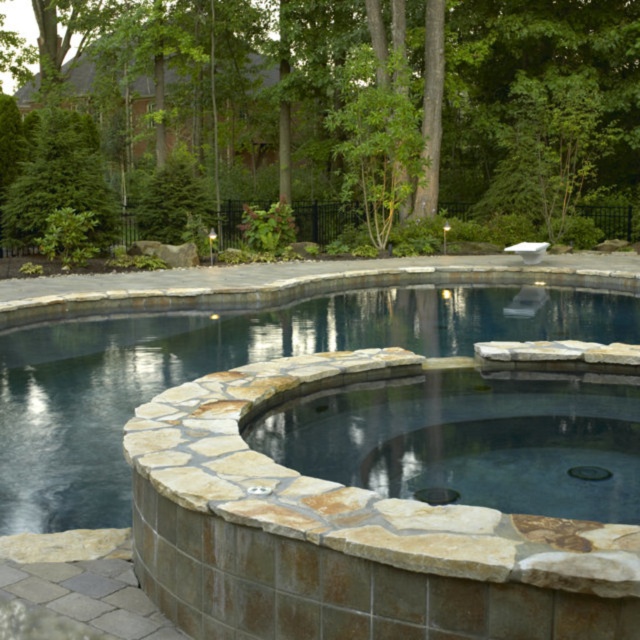
Does natural stone pool at center have a smaller size compared to natural stone hot tub at center?

Actually, natural stone pool at center might be larger than natural stone hot tub at center.

Describe the element at coordinates (237, 362) in the screenshot. I see `natural stone pool at center` at that location.

Identify the location of natural stone pool at center. (237, 362).

Consider the image. Measure the distance between point (476, 26) and camera.

75.70 feet

Who is more distant from viewer, (6, 218) or (484, 397)?

The point (6, 218) is more distant.

I want to click on green leafy tree at upper center, so click(x=371, y=102).

Is point (627, 88) closer to viewer compared to point (60, 332)?

That is False.

Between green leafy tree at upper center and natural stone pool at center, which one has more height?

green leafy tree at upper center

Who is more distant from viewer, (x=248, y=99) or (x=12, y=348)?

The point (x=248, y=99) is behind.

Find the location of a particular element. The image size is (640, 640). green leafy tree at upper center is located at coordinates (371, 102).